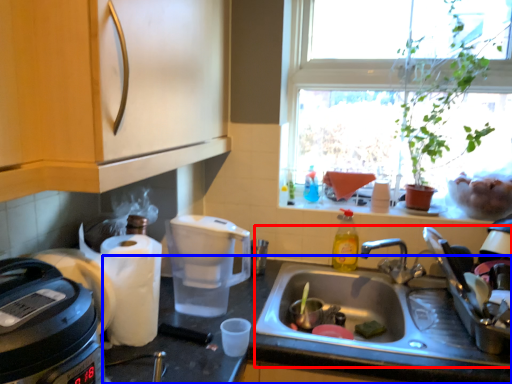
Question: Among these objects, which one is farthest to the camera, sink (highlighted by a red box) or countertop (highlighted by a blue box)?

Choices:
 (A) sink
 (B) countertop

Answer: (A)